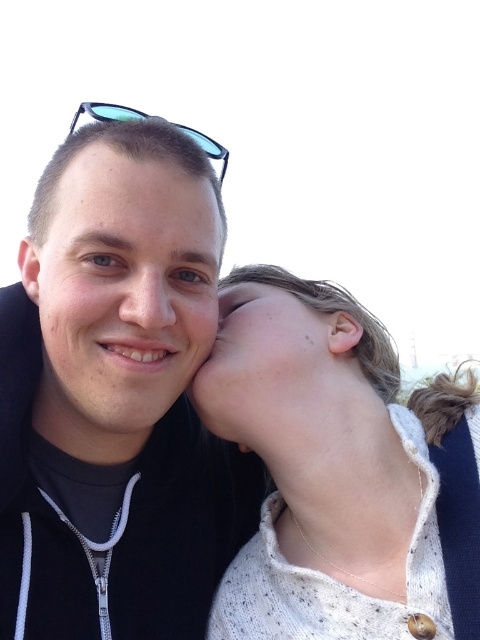
You are a photographer trying to capture a close shot of the knitted sweater at center and the matte skin forehead at center. Which object should you focus on first to ensure it appears sharp in the photo?

The knitted sweater at center is further to the viewer than the matte skin forehead at center, so you should focus on the knitted sweater at center first to ensure it appears sharp.

You are a photographer trying to capture a clear shot of the black plastic sunglasses at upper center. However, the black matte jacket at center is blocking your view. Can you determine if the sunglasses are still visible behind the jacket?

The black matte jacket at center is in front of the black plastic sunglasses at upper center, so the sunglasses are likely not visible behind the jacket.

You are a photographer trying to capture the scene. You notice the black matte jacket at center and the black plastic sunglasses at upper center. Which object is narrower in width when viewed from your camera angle?

The black matte jacket at center is thinner than the black plastic sunglasses at upper center, so the black matte jacket at center is narrower in width.